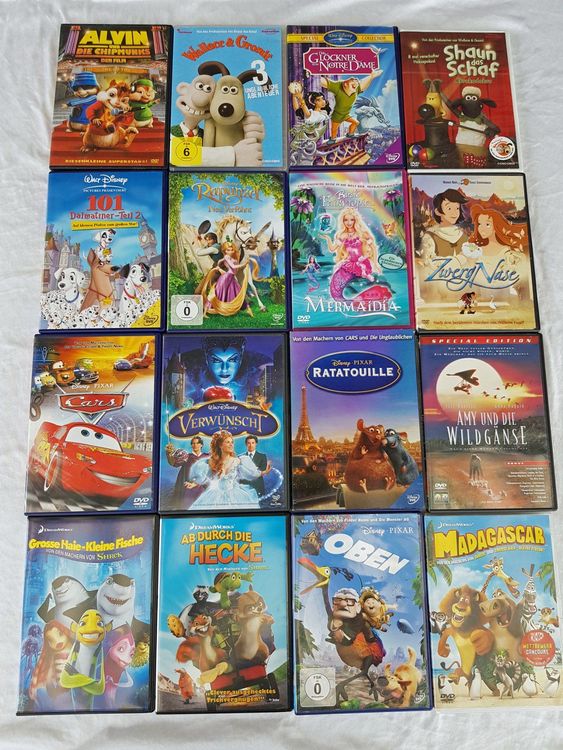
This screenshot has height=750, width=563. Find the location of `first row of dvds`. first row of dvds is located at coordinates (443, 105), (337, 102), (226, 106), (120, 105).